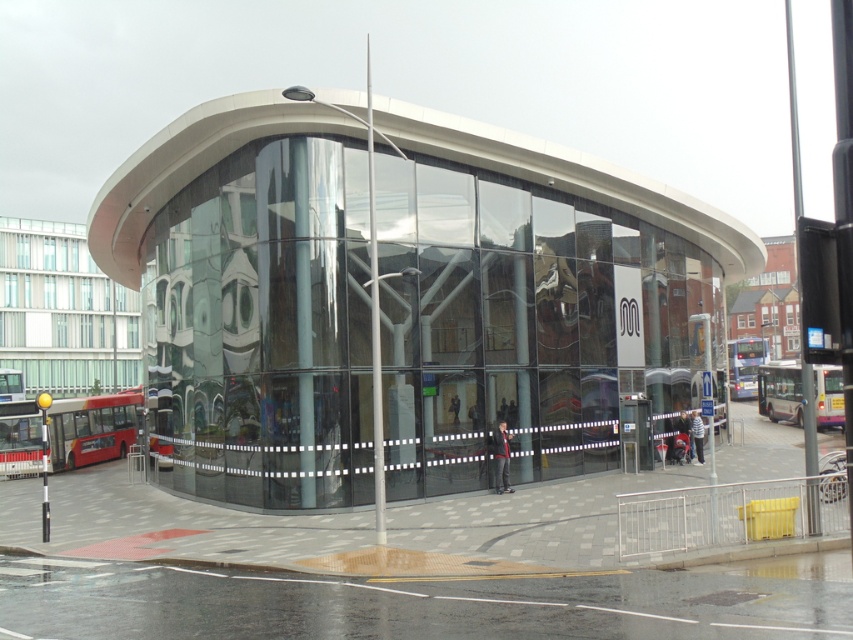
You are a city planner analyzing the layout of a transportation hub. You need to determine if the red metallic bus at lower left can fully enter the transparent glass bus station at center without any part of the bus sticking out. Based on the provided scene description, can you confirm if this is possible?

The transparent glass bus station at center is larger in size than the red metallic bus at lower left, so yes, the red metallic bus at lower left can fully enter the transparent glass bus station at center without any part sticking out.

You are a city planner assessing the visibility of the transparent glass bus station at center and the red metallic bus at lower left from across the street. Which object appears taller when viewed from that perspective?

The transparent glass bus station at center appears taller because it has a greater height compared to the red metallic bus at lower left.

You are a city planner analyzing the layout of a transportation hub. You need to determine if the blue metallic bus at center can fit inside the transparent glass bus station at center. Based on the scene description, can it?

The transparent glass bus station at center is bigger than the blue metallic bus at center, so yes, the blue metallic bus at center can fit inside the transparent glass bus station at center.